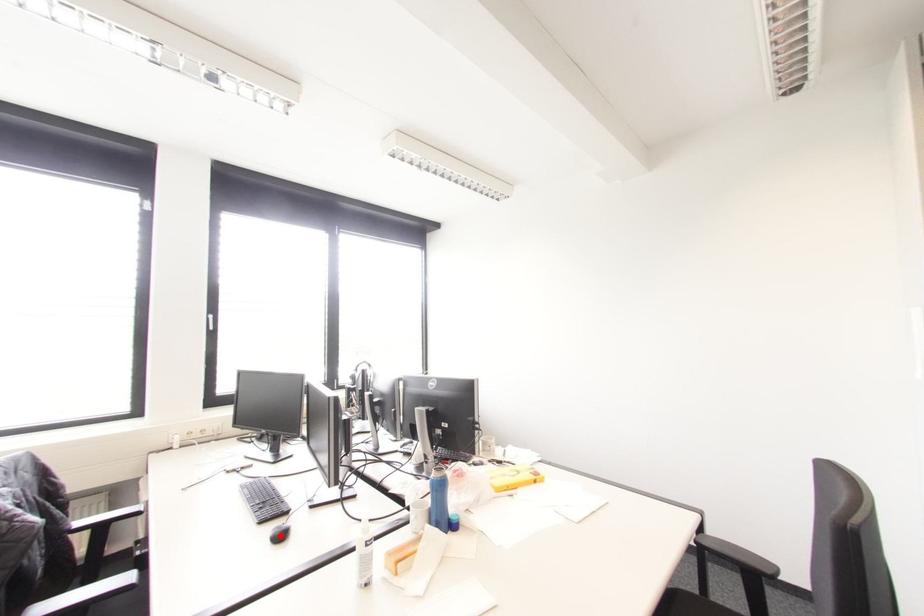
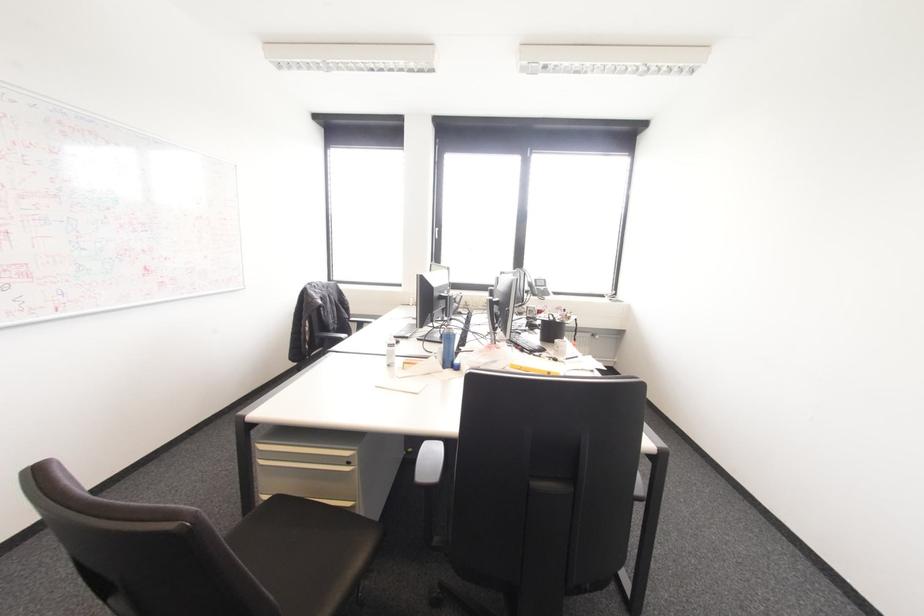
Question: I am providing you with two images of the same scene from different viewpoints. A red point is marked on the first image. Is the red point's position out of view in image 2?

Choices:
 (A) Yes
 (B) No

Answer: (A)